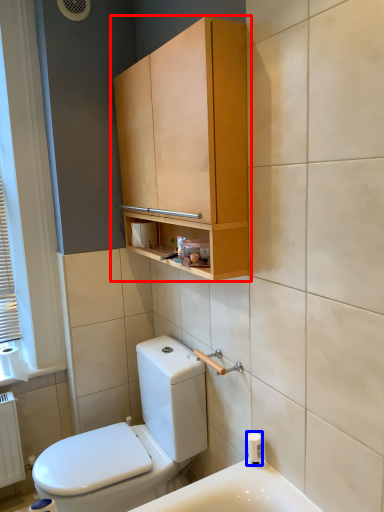
Question: Which object is closer to the camera taking this photo, bathroom cabinet (highlighted by a red box) or toiletry (highlighted by a blue box)?

Choices:
 (A) bathroom cabinet
 (B) toiletry

Answer: (A)